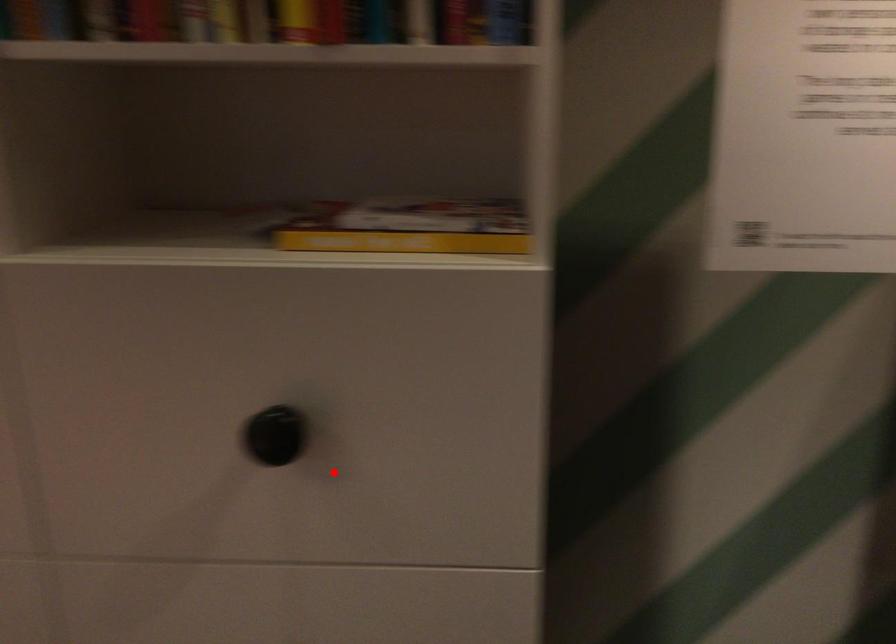
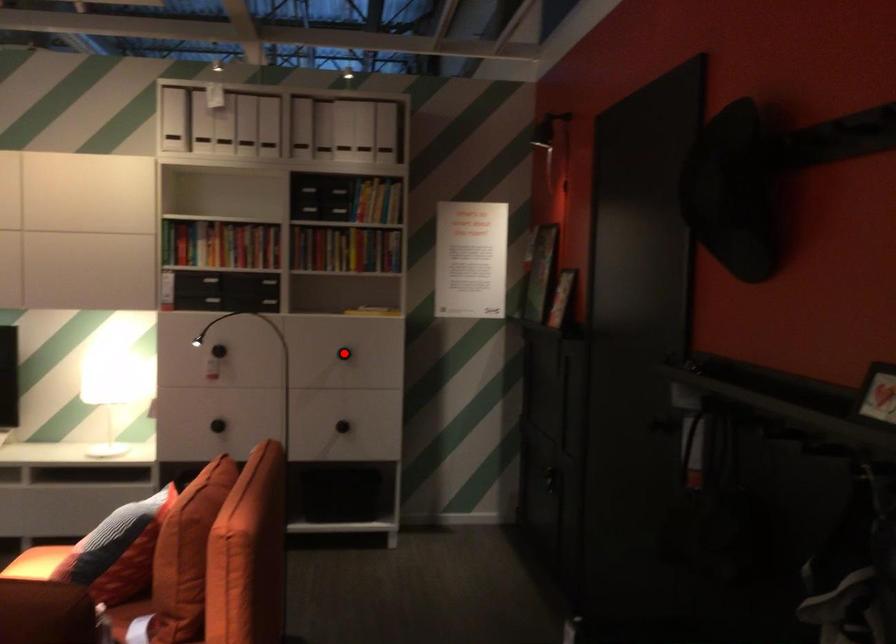
I am providing you with two images of the same scene from different viewpoints. A red point is marked on the first image and another point is marked on the second image. Is the red point in image1 aligned with the point shown in image2?

Yes